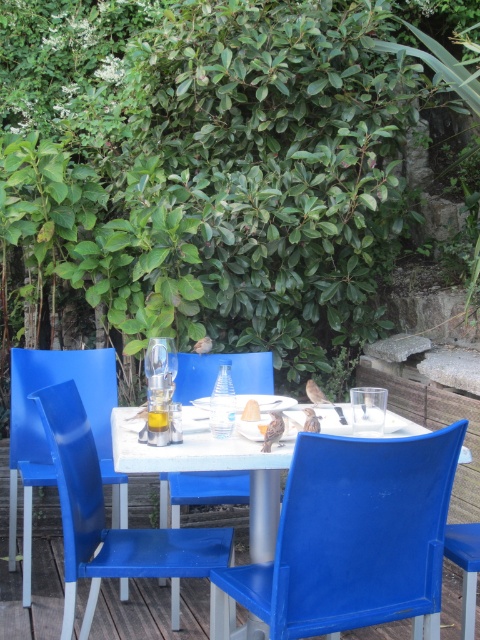
You are hosting a dinner party and need to seat two guests with different preferences. One prefers a taller seat for a better view, and the other prefers a shorter seat for comfort. Given the glossy plastic chair at left and the blue plastic chair at center, which chair should each guest choose?

The guest who prefers a taller seat for a better view should choose the glossy plastic chair at left, while the guest who prefers a shorter seat for comfort should choose the blue plastic chair at center, as the glossy plastic chair at left is taller than the blue plastic chair at center.

You are planning to seat two guests at the table. You have two chairs available, the glossy plastic chair at left and the blue plastic chair at center. Which chair is wider so that it can accommodate a guest with a larger frame?

The glossy plastic chair at left is wider than the blue plastic chair at center, so it can accommodate a guest with a larger frame.

You are planning to seat two guests at the outdoor dining table. You have two chairs available, the glossy plastic chair at left and the blue plastic chair at center. Which chair should you choose to accommodate a taller guest?

The glossy plastic chair at left is larger in size than the blue plastic chair at center, so it would be more suitable for accommodating a taller guest.